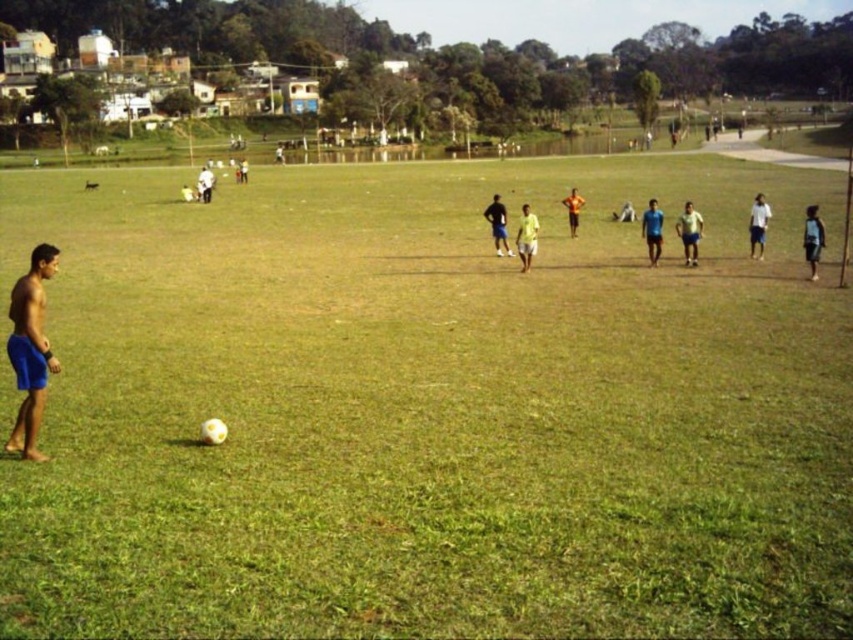
You are a soccer player standing on the field and you see the blue shorts at center and the white shirt at center. Which one is closer to you?

The blue shorts at center is closer to you because it is in front of the white shirt at center.

You are a soccer coach observing the players on the field. You notice two players wearing blue shorts at center and white shirt at center. Which player takes up more space in the image?

The white shirt at center takes up more space in the image than the blue shorts at center.

You are a soccer coach observing the players on the field. You notice two players wearing blue shorts at center and yellow fabric shirt at center. Which player is positioned to the right side of the other?

The blue shorts at center is positioned on the right side of yellow fabric shirt at center.